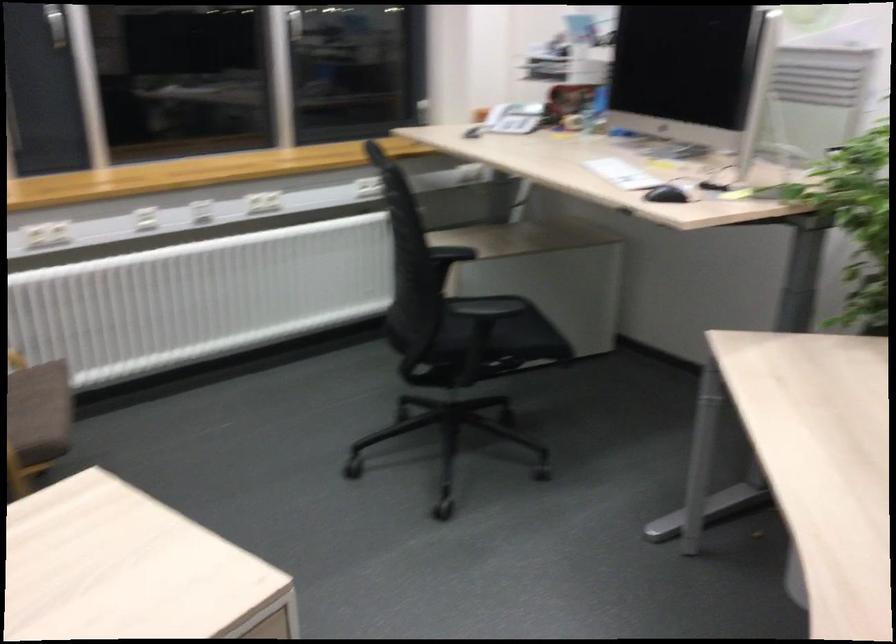
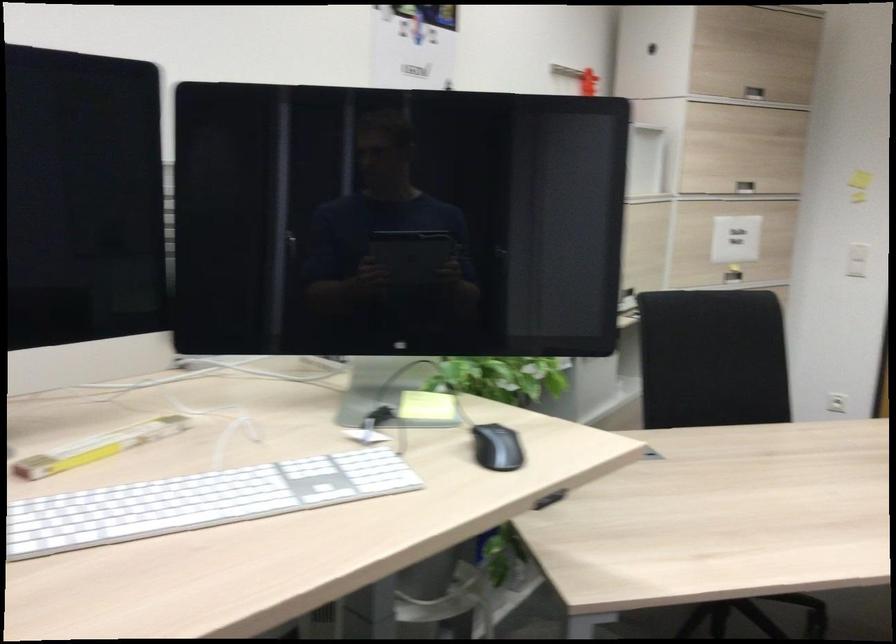
In the second image, find the point that corresponds to (630,169) in the first image.

(200, 500)